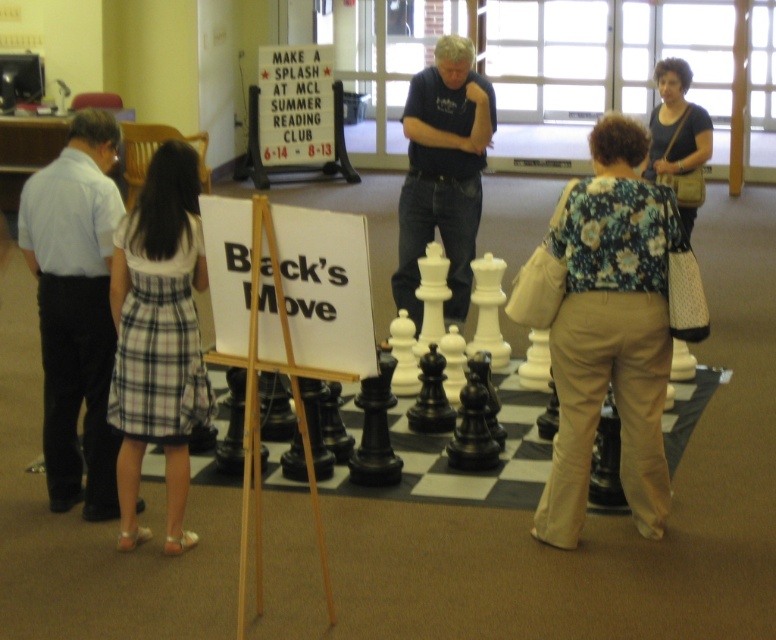
Question: Which object is positioned farthest from the floral fabric blouse at center?

Choices:
 (A) plaid fabric skirt at lower left
 (B) light blue shirt at left
 (C) matte brown purse at upper right
 (D) dark blue shirt at center

Answer: (B)

Question: Does floral fabric blouse at center have a lesser width compared to light blue shirt at left?

Choices:
 (A) yes
 (B) no

Answer: (B)

Question: Does floral fabric blouse at center lie in front of plaid fabric skirt at lower left?

Choices:
 (A) no
 (B) yes

Answer: (A)

Question: Which of these objects is positioned farthest from the plaid fabric skirt at lower left?

Choices:
 (A) light blue shirt at left
 (B) matte brown purse at upper right
 (C) dark blue shirt at center
 (D) floral fabric blouse at center

Answer: (B)

Question: Which point appears farthest from the camera in this image?

Choices:
 (A) (657, 81)
 (B) (85, 296)
 (C) (636, 332)
 (D) (428, 237)

Answer: (A)

Question: Can you confirm if light blue shirt at left is smaller than plaid fabric skirt at lower left?

Choices:
 (A) no
 (B) yes

Answer: (A)